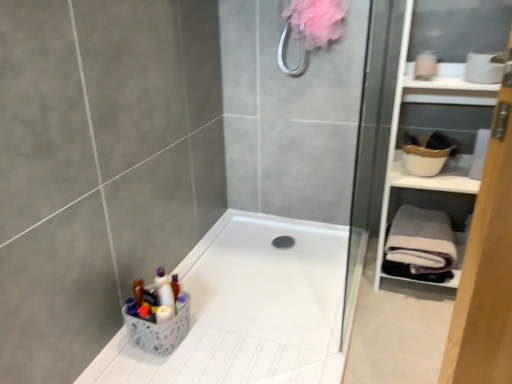
What are the coordinates of `free space above white plastic bathtub at lower left (from a real-world perspective)` in the screenshot? It's located at (244, 290).